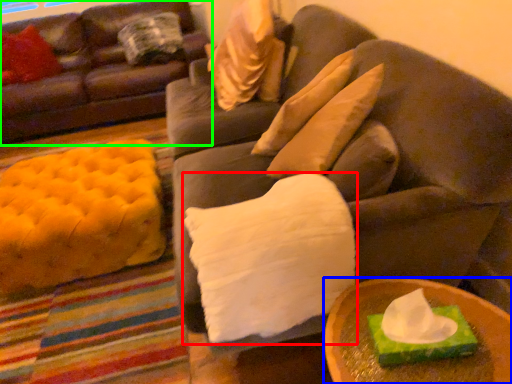
Question: Based on their relative distances, which object is farther from pillow (highlighted by a red box)? Choose from table (highlighted by a blue box) and studio couch (highlighted by a green box).

Choices:
 (A) table
 (B) studio couch

Answer: (B)